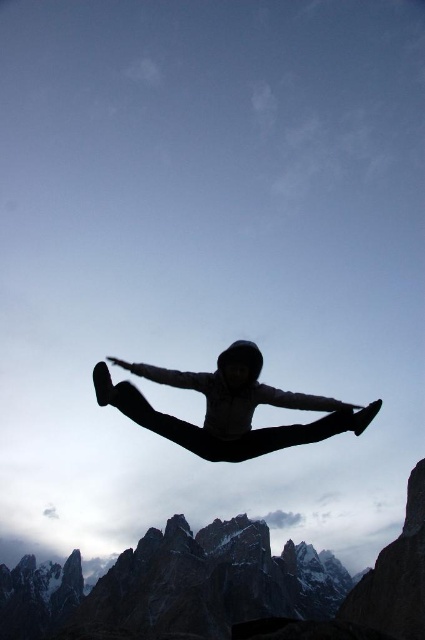
Is rugged stone mountain at center positioned in front of black matte person at center?

Yes, rugged stone mountain at center is in front of black matte person at center.

Who is taller, rugged stone mountain at center or black matte person at center?

rugged stone mountain at center is taller.

Is point (391, 608) closer to viewer compared to point (235, 392)?

No.

Where is `rugged stone mountain at center`? The image size is (425, 640). rugged stone mountain at center is located at coordinates (218, 584).